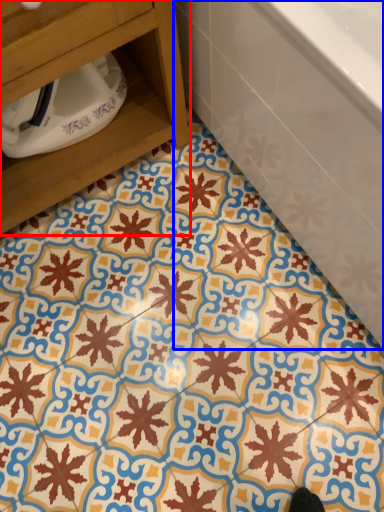
Question: Which point is closer to the camera, furniture (highlighted by a red box) or bathtub (highlighted by a blue box)?

Choices:
 (A) furniture
 (B) bathtub

Answer: (B)